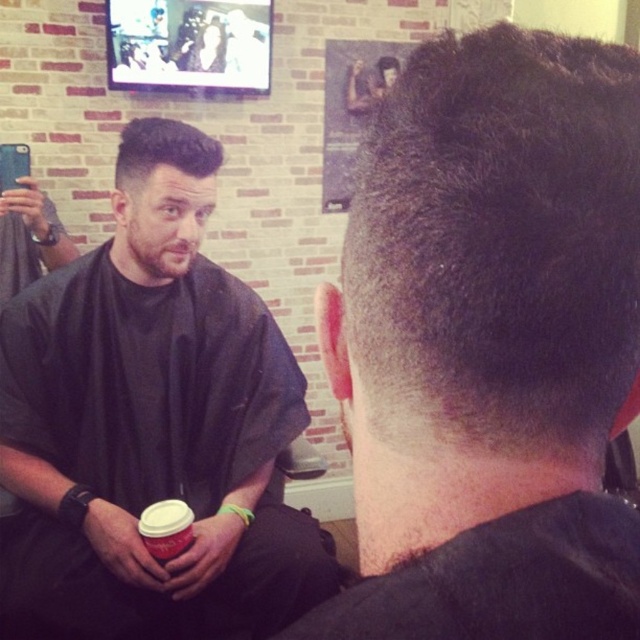
Is dark brown hair at center thinner than sleek dark hair at upper left?

Correct, dark brown hair at center's width is less than sleek dark hair at upper left's.

Between dark brown hair at center and sleek dark hair at upper left, which one appears on the right side from the viewer's perspective?

Positioned to the right is dark brown hair at center.

Where is `dark brown hair at center`? Image resolution: width=640 pixels, height=640 pixels. dark brown hair at center is located at coordinates (490, 344).

In order to click on dark brown hair at center in this screenshot , I will do `click(490, 344)`.

Between dark brown hair at center and matte black hair at upper left, which one appears on the right side from the viewer's perspective?

From the viewer's perspective, dark brown hair at center appears more on the right side.

I want to click on dark brown hair at center, so click(x=490, y=344).

The width and height of the screenshot is (640, 640). Find the location of `dark brown hair at center`. dark brown hair at center is located at coordinates [490, 344].

Which is behind, point (179, 422) or point (179, 160)?

The point (179, 422) is more distant.

Based on the photo, is matte black hair at upper left above sleek dark hair at upper left?

No.

Does point (198, 268) lie behind point (152, 116)?

No, (198, 268) is closer to viewer.

Locate an element on the screen. The width and height of the screenshot is (640, 640). matte black hair at upper left is located at coordinates (150, 426).